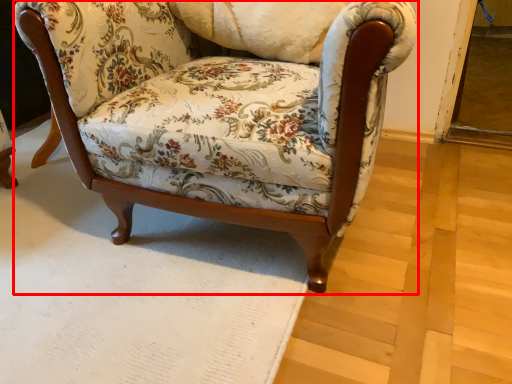
Question: Observing the image, what is the correct spatial positioning of chair (annotated by the red box) in reference to pillow?

Choices:
 (A) right
 (B) left

Answer: (A)